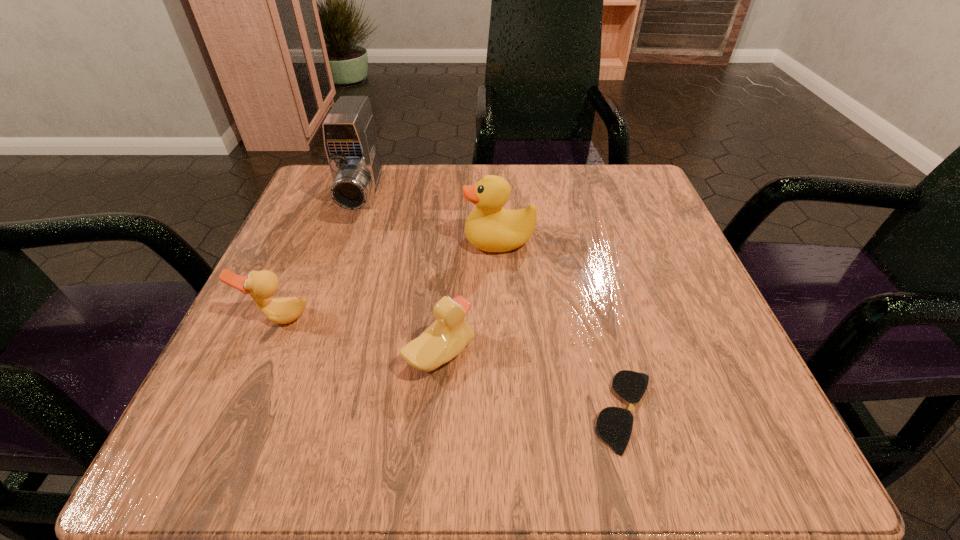
This screenshot has width=960, height=540. Identify the location of blank space located on the beak of the leftmost duck. [x=240, y=407].

At what (x,y) coordinates should I click in order to perform the action: click on free space located 0.120m on the left of the shortest object. Please return your answer as a coordinate pair (x, y). This screenshot has height=540, width=960. Looking at the image, I should click on (499, 411).

Where is `camcorder present at the far edge`? This screenshot has width=960, height=540. camcorder present at the far edge is located at coordinates (351, 143).

Find the location of a particular element. The width and height of the screenshot is (960, 540). duck that is positioned at the far edge is located at coordinates (489, 227).

Where is `object present at the near edge`? This screenshot has height=540, width=960. object present at the near edge is located at coordinates (614, 425).

I want to click on camcorder situated at the left edge, so click(351, 143).

The height and width of the screenshot is (540, 960). What are the coordinates of `duck present at the left edge` in the screenshot? It's located at click(261, 285).

This screenshot has width=960, height=540. I want to click on object that is positioned at the right edge, so click(x=614, y=425).

I want to click on object present at the far left corner, so click(x=351, y=143).

Identify the location of object that is positioned at the near right corner. This screenshot has width=960, height=540. (614, 425).